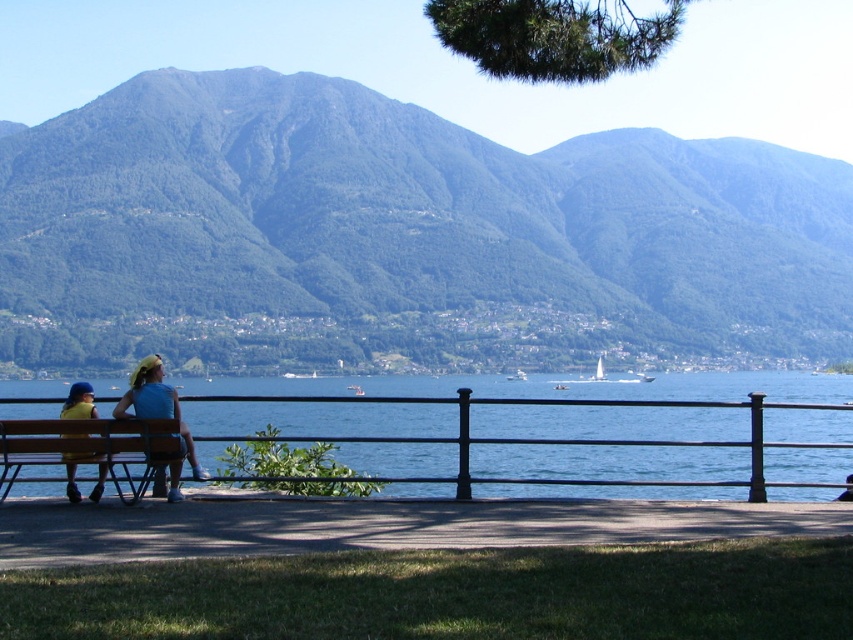
Does green forested mountain at upper center have a greater width compared to yellow fabric dress at left?

Yes, green forested mountain at upper center is wider than yellow fabric dress at left.

Can you confirm if green forested mountain at upper center is shorter than yellow fabric dress at left?

No, green forested mountain at upper center is not shorter than yellow fabric dress at left.

Is point (18, 291) closer to viewer compared to point (73, 481)?

No, (18, 291) is behind (73, 481).

The height and width of the screenshot is (640, 853). What are the coordinates of `green forested mountain at upper center` in the screenshot? It's located at (399, 236).

Who is lower down, black metal fence at lower center or wooden bench at lower left?

black metal fence at lower center is lower down.

Does black metal fence at lower center appear on the left side of wooden bench at lower left?

Yes, black metal fence at lower center is to the left of wooden bench at lower left.

Between point (648, 456) and point (18, 468), which one is positioned behind?

The point (648, 456) is behind.

Locate an element on the screen. The image size is (853, 640). black metal fence at lower center is located at coordinates (553, 388).

Does black metal fence at lower center lie behind yellow fabric dress at left?

Yes.

Does black metal fence at lower center appear on the right side of yellow fabric dress at left?

Correct, you'll find black metal fence at lower center to the right of yellow fabric dress at left.

Find the location of a particular element. This screenshot has width=853, height=640. black metal fence at lower center is located at coordinates (553, 388).